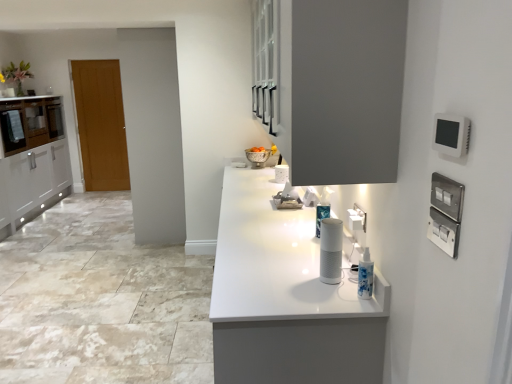
Question: Is silver metallic bowl at center positioned with its back to wooden door at left?

Choices:
 (A) no
 (B) yes

Answer: (A)

Question: Considering the relative sizes of silver metallic bowl at center and wooden door at left in the image provided, is silver metallic bowl at center wider than wooden door at left?

Choices:
 (A) no
 (B) yes

Answer: (B)

Question: Is silver metallic bowl at center outside wooden door at left?

Choices:
 (A) yes
 (B) no

Answer: (A)

Question: Can you confirm if silver metallic bowl at center is thinner than wooden door at left?

Choices:
 (A) yes
 (B) no

Answer: (B)

Question: From the image's perspective, does silver metallic bowl at center appear higher than wooden door at left?

Choices:
 (A) yes
 (B) no

Answer: (B)

Question: Based on their positions, is white glossy countertop at center located to the left or right of silver metallic bowl at center?

Choices:
 (A) right
 (B) left

Answer: (A)

Question: From the image's perspective, is white glossy countertop at center positioned above or below silver metallic bowl at center?

Choices:
 (A) below
 (B) above

Answer: (A)

Question: From a real-world perspective, relative to silver metallic bowl at center, is white glossy countertop at center vertically above or below?

Choices:
 (A) below
 (B) above

Answer: (A)

Question: Considering their positions, is white glossy countertop at center located in front of or behind silver metallic bowl at center?

Choices:
 (A) front
 (B) behind

Answer: (A)

Question: In the image, is wooden door at left positioned in front of or behind white plastic electric outlet at right?

Choices:
 (A) front
 (B) behind

Answer: (B)

Question: Looking at their shapes, would you say wooden door at left is wider or thinner than white plastic electric outlet at right?

Choices:
 (A) thin
 (B) wide

Answer: (B)

Question: In the image, is wooden door at left on the left side or the right side of white plastic electric outlet at right?

Choices:
 (A) left
 (B) right

Answer: (A)

Question: Is wooden door at left taller or shorter than white plastic electric outlet at right?

Choices:
 (A) tall
 (B) short

Answer: (A)

Question: In the image, is matte white cabinet at left, marked as the second cabinetry in a right-to-left arrangement, positioned in front of or behind wooden door at left?

Choices:
 (A) front
 (B) behind

Answer: (A)

Question: Considering the positions of matte white cabinet at left, which is the second cabinetry in front-to-back order, and wooden door at left in the image, is matte white cabinet at left, which is the second cabinetry in front-to-back order, taller or shorter than wooden door at left?

Choices:
 (A) tall
 (B) short

Answer: (B)